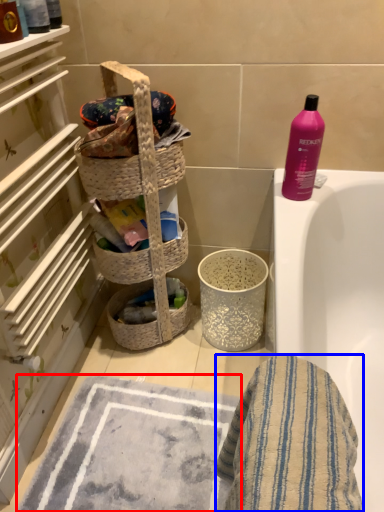
Question: Which object is closer to the camera taking this photo, bath mat (highlighted by a red box) or bath towel (highlighted by a blue box)?

Choices:
 (A) bath mat
 (B) bath towel

Answer: (B)